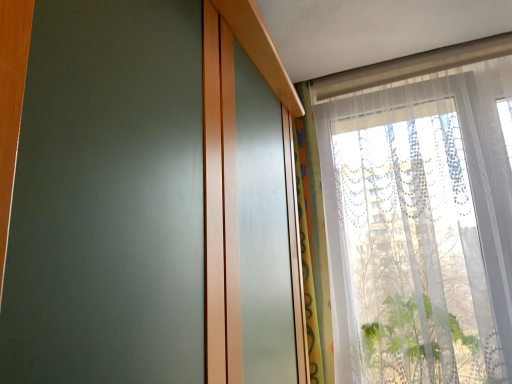
This screenshot has height=384, width=512. What do you see at coordinates (419, 217) in the screenshot?
I see `transparent lace curtain at upper right` at bounding box center [419, 217].

Identify the location of transparent lace curtain at upper right. The image size is (512, 384). (419, 217).

This screenshot has height=384, width=512. What do you see at coordinates (313, 244) in the screenshot?
I see `translucent fabric curtain at upper right` at bounding box center [313, 244].

Find the location of `translucent fabric curtain at upper right`. translucent fabric curtain at upper right is located at coordinates (313, 244).

Locate an element on the screen. The width and height of the screenshot is (512, 384). transparent lace curtain at upper right is located at coordinates (419, 217).

Based on their positions, is transparent lace curtain at upper right located to the left or right of translucent fabric curtain at upper right?

In the image, transparent lace curtain at upper right appears on the right side of translucent fabric curtain at upper right.

Between transparent lace curtain at upper right and translucent fabric curtain at upper right, which one is positioned behind?

translucent fabric curtain at upper right is further away from the camera.

Is point (473, 239) closer to viewer compared to point (328, 296)?

Yes, point (473, 239) is in front of point (328, 296).

From the image's perspective, who appears lower, transparent lace curtain at upper right or translucent fabric curtain at upper right?

From the image's view, translucent fabric curtain at upper right is below.

From a real-world perspective, does transparent lace curtain at upper right sit lower than translucent fabric curtain at upper right?

Yes, from a real-world perspective, transparent lace curtain at upper right is below translucent fabric curtain at upper right.

Is transparent lace curtain at upper right wider than translucent fabric curtain at upper right?

Correct, the width of transparent lace curtain at upper right exceeds that of translucent fabric curtain at upper right.

Considering the sizes of objects transparent lace curtain at upper right and translucent fabric curtain at upper right in the image provided, who is shorter, transparent lace curtain at upper right or translucent fabric curtain at upper right?

Standing shorter between the two is transparent lace curtain at upper right.

Between transparent lace curtain at upper right and translucent fabric curtain at upper right, which one has smaller size?

Smaller between the two is translucent fabric curtain at upper right.

Can translucent fabric curtain at upper right be found inside transparent lace curtain at upper right?

Definitely not — translucent fabric curtain at upper right is not inside transparent lace curtain at upper right.

Is transparent lace curtain at upper right far away from translucent fabric curtain at upper right?

They are positioned close to each other.

Is transparent lace curtain at upper right looking in the opposite direction of translucent fabric curtain at upper right?

No, translucent fabric curtain at upper right is not at the back of transparent lace curtain at upper right.

What's the angular difference between transparent lace curtain at upper right and translucent fabric curtain at upper right's facing directions?

There is a 14.1-degree angle between the facing directions of transparent lace curtain at upper right and translucent fabric curtain at upper right.

The height and width of the screenshot is (384, 512). I want to click on curtain located above the transparent lace curtain at upper right (from a real-world perspective), so click(x=313, y=244).

Can you confirm if translucent fabric curtain at upper right is positioned to the right of transparent lace curtain at upper right?

In fact, translucent fabric curtain at upper right is to the left of transparent lace curtain at upper right.

Considering the positions of objects translucent fabric curtain at upper right and transparent lace curtain at upper right in the image provided, who is behind, translucent fabric curtain at upper right or transparent lace curtain at upper right?

translucent fabric curtain at upper right is more distant.

Is point (303, 170) in front of point (452, 378)?

No.

From the image's perspective, would you say translucent fabric curtain at upper right is shown under transparent lace curtain at upper right?

Yes.

From a real-world perspective, between translucent fabric curtain at upper right and transparent lace curtain at upper right, who is vertically higher?

In real-world perspective, translucent fabric curtain at upper right is above.

Can you confirm if translucent fabric curtain at upper right is thinner than transparent lace curtain at upper right?

Yes, translucent fabric curtain at upper right is thinner than transparent lace curtain at upper right.

Is translucent fabric curtain at upper right shorter than transparent lace curtain at upper right?

No, translucent fabric curtain at upper right is not shorter than transparent lace curtain at upper right.

Which of these two, translucent fabric curtain at upper right or transparent lace curtain at upper right, is smaller?

With smaller size is translucent fabric curtain at upper right.

Is transparent lace curtain at upper right surrounded by translucent fabric curtain at upper right?

Actually, transparent lace curtain at upper right is outside translucent fabric curtain at upper right.

Would you consider translucent fabric curtain at upper right to be distant from transparent lace curtain at upper right?

That's not correct — translucent fabric curtain at upper right is a little close to transparent lace curtain at upper right.

Does translucent fabric curtain at upper right turn towards transparent lace curtain at upper right?

No, translucent fabric curtain at upper right is not facing towards transparent lace curtain at upper right.

What's the angular difference between translucent fabric curtain at upper right and transparent lace curtain at upper right's facing directions?

translucent fabric curtain at upper right and transparent lace curtain at upper right are facing 14.1 degrees away from each other.

Measure the distance between translucent fabric curtain at upper right and transparent lace curtain at upper right.

translucent fabric curtain at upper right is 29.20 centimeters from transparent lace curtain at upper right.

The height and width of the screenshot is (384, 512). In order to click on window above the translucent fabric curtain at upper right (from the image's perspective) in this screenshot , I will do `click(419, 217)`.

Find the location of a particular element. window to the right of translucent fabric curtain at upper right is located at coordinates point(419,217).

Find the location of a particular element. window below the translucent fabric curtain at upper right (from a real-world perspective) is located at coordinates (419, 217).